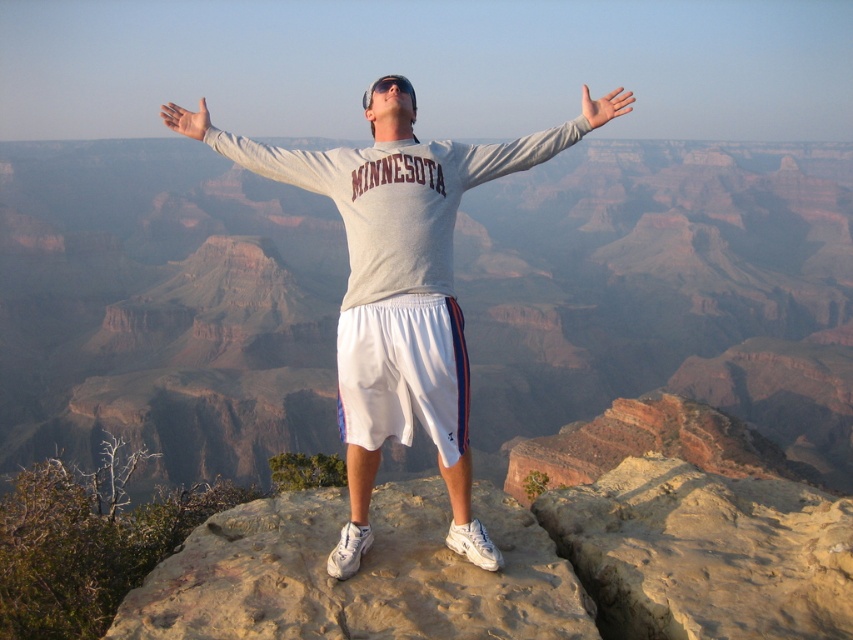
You are a drone operator tasked with capturing a photo of the gray matte arm at center. The camera is positioned at the point marked by coordinates point (535,141). Will the camera be able to capture the gray matte arm at center in the photo?

The point (535,141) marks the gray matte arm at center, so the camera positioned there would be capturing the arm itself, meaning it would be in the photo.

You are a photographer trying to capture the best angle of the person standing on the rocky outcrop. You notice two points marked in the scene. Which point, point 1 at coordinates (396,252) or point 2 at coordinates (231,157), is closer to the camera and thus better for focusing on the person?

Point 1 at coordinates (396,252) is closer to the camera than point 2 at coordinates (231,157), so it is better for focusing on the person.